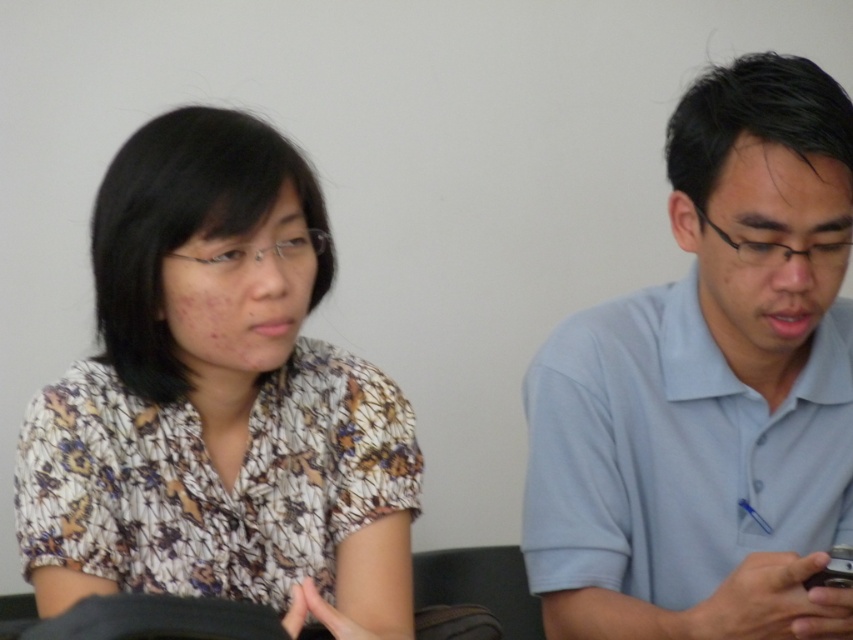
You are an assistant organizing a clothing store. You need to place the floral fabric blouse at left and the light blue cotton shirt at right on a mannequin. Which piece of clothing should be placed on the left side of the mannequin?

The floral fabric blouse at left should be placed on the left side of the mannequin since it is positioned to the left of the light blue cotton shirt at right in the image.

You are a photographer setting up for a portrait session. You notice the floral fabric blouse at left and the light blue cotton shirt at right in the frame. Which clothing item is positioned closer to your camera lens?

The floral fabric blouse at left is closer to the viewer than the light blue cotton shirt at right, so the photographer should adjust the focus to prioritize the floral fabric blouse at left for a sharp image.

You are a photographer setting up for a portrait session. You want to ensure there is enough space between the two subjects wearing the floral fabric blouse at left and the light blue cotton shirt at right for a natural pose. The minimum recommended distance between subjects for this pose is 15 inches. Based on the image, is the current spacing sufficient?

The floral fabric blouse at left and light blue cotton shirt at right are 14.73 inches apart from each other. Since 14.73 inches is less than the recommended 15 inches, the current spacing is insufficient for the natural pose.